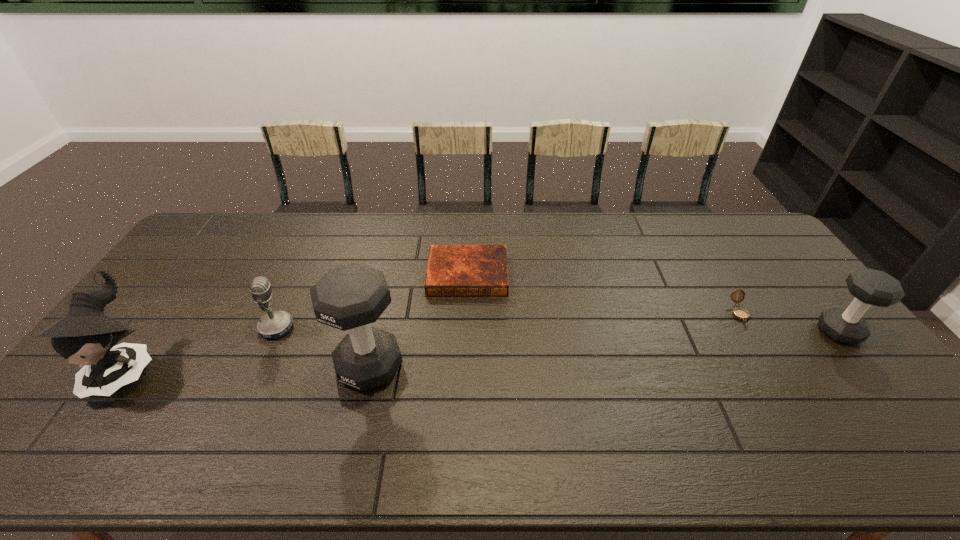
Locate an element on the screen. This screenshot has height=540, width=960. blank space that satisfies the following two spatial constraints: 1. on the spine side of the shortest object; 2. on the front-facing side of the second object from left to right is located at coordinates (466, 328).

Locate an element on the screen. This screenshot has width=960, height=540. vacant space that satisfies the following two spatial constraints: 1. on the front-facing side of the fifth object from right to left; 2. on the left side of the rightmost object is located at coordinates (275, 332).

This screenshot has height=540, width=960. I want to click on free spot that satisfies the following two spatial constraints: 1. on the face of the compass; 2. on the left side of the shorter dumbbell, so click(750, 332).